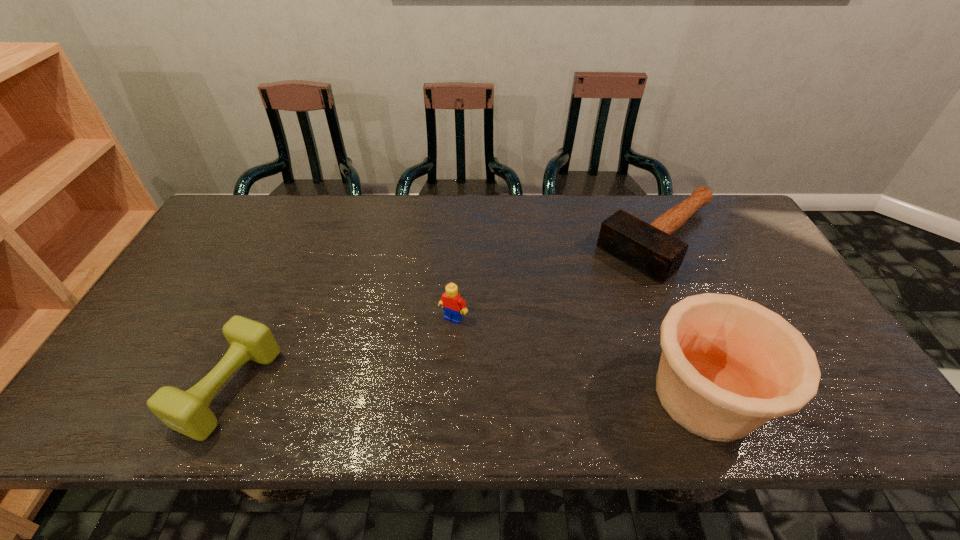
Identify the location of free space located 0.180m on the face of the third object from right to left. This screenshot has width=960, height=540. (413, 380).

Identify the location of vacant space situated 0.130m on the face of the third object from right to left. (423, 363).

In order to click on free point located 0.170m on the face of the third object from right to left in this screenshot , I will do `click(415, 377)`.

Find the location of a particular element. This screenshot has height=540, width=960. object that is at the far edge is located at coordinates (649, 248).

Image resolution: width=960 pixels, height=540 pixels. What are the coordinates of `dumbbell located at the near edge` in the screenshot? It's located at (187, 412).

Where is `pottery positioned at the near edge`? The height and width of the screenshot is (540, 960). pottery positioned at the near edge is located at coordinates (729, 365).

Find the location of `object that is at the right edge`. object that is at the right edge is located at coordinates (649, 248).

Identify the location of object positioned at the far right corner. (649, 248).

This screenshot has width=960, height=540. In order to click on free space at the far edge in this screenshot , I will do `click(445, 203)`.

This screenshot has height=540, width=960. In order to click on vacant space at the near edge of the desktop in this screenshot , I will do `click(592, 374)`.